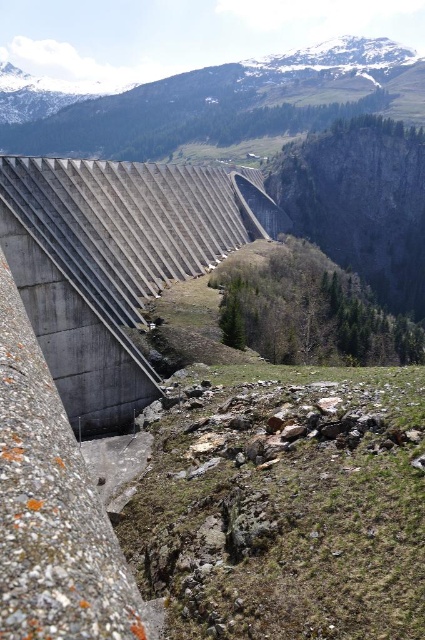
Question: Is concrete dam at center wider than snowy granite mountain at upper center?

Choices:
 (A) yes
 (B) no

Answer: (B)

Question: Which object appears farthest from the camera in this image?

Choices:
 (A) snowy granite mountain at upper center
 (B) concrete dam at center

Answer: (A)

Question: Which point appears closest to the camera in this image?

Choices:
 (A) (192, 234)
 (B) (340, 54)

Answer: (A)

Question: Does concrete dam at center appear under snowy granite mountain at upper center?

Choices:
 (A) no
 (B) yes

Answer: (B)

Question: Can you confirm if concrete dam at center is thinner than snowy granite mountain at upper center?

Choices:
 (A) yes
 (B) no

Answer: (A)